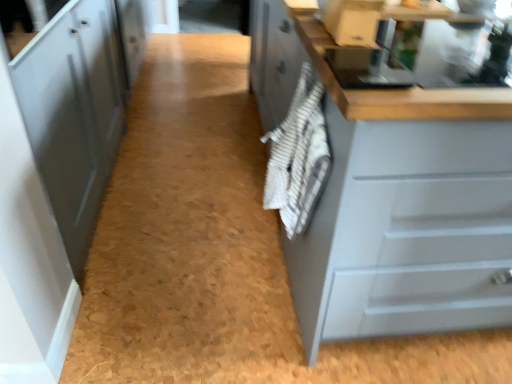
Identify the location of vacant space underneath white striped towel at center (from a real-world perspective). The height and width of the screenshot is (384, 512). coord(269,320).